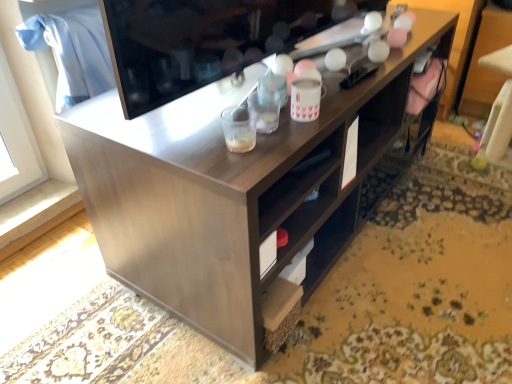
This screenshot has height=384, width=512. What are the coordinates of `matte black television at upper center` in the screenshot? It's located at (203, 41).

Locate an element on the screen. The width and height of the screenshot is (512, 384). translucent plastic cup at center, the second beverage when ordered from back to front is located at coordinates (239, 130).

Which is nearer, (203, 82) or (301, 94)?

Point (203, 82) is farther from the camera than point (301, 94).

Considering the sizes of matte black television at upper center and white ceramic mug at upper center, which is the first beverage in right-to-left order, in the image, is matte black television at upper center taller or shorter than white ceramic mug at upper center, which is the first beverage in right-to-left order,?

Clearly, matte black television at upper center is taller compared to white ceramic mug at upper center, which is the first beverage in right-to-left order.

From a real-world perspective, is matte black television at upper center on top of white ceramic mug at upper center, the second beverage positioned from the front?

Yes, from a real-world perspective, matte black television at upper center is above white ceramic mug at upper center, the second beverage positioned from the front.

Could white ceramic mug at upper center, which is the first beverage in right-to-left order, be considered to be inside matte black television at upper center?

No, white ceramic mug at upper center, which is the first beverage in right-to-left order, is not inside matte black television at upper center.

Is white ceramic mug at upper center, which is the first beverage in right-to-left order, looking in the opposite direction of matte black television at upper center?

Yes, matte black television at upper center is at the back of white ceramic mug at upper center, which is the first beverage in right-to-left order.

Would you say white ceramic mug at upper center, which appears as the second beverage when viewed from the left, is to the left or to the right of matte black television at upper center in the picture?

In the image, white ceramic mug at upper center, which appears as the second beverage when viewed from the left, appears on the right side of matte black television at upper center.

Choose the correct answer: Is white ceramic mug at upper center, the second beverage positioned from the front, inside matte black television at upper center or outside it?

The correct answer is: outside.

From the image's perspective, who appears lower, translucent plastic cup at center, arranged as the 1th beverage when viewed from the left, or white ceramic mug at upper center, arranged as the 1th beverage when viewed from the back?

From the image's view, translucent plastic cup at center, arranged as the 1th beverage when viewed from the left, is below.

In terms of height, does translucent plastic cup at center, which is counted as the 1th beverage, starting from the front, look taller or shorter compared to white ceramic mug at upper center, arranged as the 1th beverage when viewed from the back?

translucent plastic cup at center, which is counted as the 1th beverage, starting from the front, is shorter than white ceramic mug at upper center, arranged as the 1th beverage when viewed from the back.

Which is in front, point (231, 138) or point (295, 107)?

Point (231, 138)

From a real-world perspective, between white ceramic mug at upper center, arranged as the 1th beverage when viewed from the back, and translucent plastic cup at center, the second beverage when ordered from back to front, who is vertically higher?

white ceramic mug at upper center, arranged as the 1th beverage when viewed from the back, is physically above.

How different are the orientations of white ceramic mug at upper center, which appears as the second beverage when viewed from the left, and translucent plastic cup at center, arranged as the 1th beverage when viewed from the left, in degrees?

0.0016 degrees separate the facing orientations of white ceramic mug at upper center, which appears as the second beverage when viewed from the left, and translucent plastic cup at center, arranged as the 1th beverage when viewed from the left.

Where is `beverage below the white ceramic mug at upper center, which is the first beverage in right-to-left order (from the image's perspective)`? beverage below the white ceramic mug at upper center, which is the first beverage in right-to-left order (from the image's perspective) is located at coordinates (239, 130).

From the picture: In terms of height, does white ceramic mug at upper center, the second beverage positioned from the front, look taller or shorter compared to translucent plastic cup at center, the second beverage when ordered from back to front?

In the image, white ceramic mug at upper center, the second beverage positioned from the front, appears to be taller than translucent plastic cup at center, the second beverage when ordered from back to front.

From a real-world perspective, is matte black television at upper center physically below translucent plastic cup at center, the 2th beverage from the right?

Incorrect, from a real-world perspective, matte black television at upper center is higher than translucent plastic cup at center, the 2th beverage from the right.

From the image's perspective, is matte black television at upper center positioned above or below translucent plastic cup at center, arranged as the 1th beverage when viewed from the left?

Based on their image positions, matte black television at upper center is located above translucent plastic cup at center, arranged as the 1th beverage when viewed from the left.

Is matte black television at upper center inside or outside of translucent plastic cup at center, the 2th beverage from the right?

matte black television at upper center is spatially situated outside translucent plastic cup at center, the 2th beverage from the right.

Which is in front, point (268, 47) or point (245, 125)?

The point (245, 125) is closer to the camera.

From the image's perspective, is translucent plastic cup at center, the 2th beverage from the right, located beneath matte black television at upper center?

Yes, from the image's perspective, translucent plastic cup at center, the 2th beverage from the right, is beneath matte black television at upper center.

Which of these two, translucent plastic cup at center, which is counted as the 1th beverage, starting from the front, or matte black television at upper center, stands taller?

Standing taller between the two is matte black television at upper center.

Is translucent plastic cup at center, arranged as the 1th beverage when viewed from the left, touching matte black television at upper center?

No, translucent plastic cup at center, arranged as the 1th beverage when viewed from the left, is not making contact with matte black television at upper center.

There is a matte black television at upper center. Identify the location of the 1st beverage below it (from a real-world perspective). This screenshot has width=512, height=384. point(305,100).

Locate an element on the screen. This screenshot has height=384, width=512. television lying on the left of white ceramic mug at upper center, which appears as the second beverage when viewed from the left is located at coordinates (203, 41).

When comparing their distances from white ceramic mug at upper center, the second beverage positioned from the front, does translucent plastic cup at center, which is counted as the 1th beverage, starting from the front, or matte black television at upper center seem closer?

translucent plastic cup at center, which is counted as the 1th beverage, starting from the front.

From the picture: Estimate the real-world distances between objects in this image. Which object is further from white ceramic mug at upper center, the second beverage positioned from the front, matte black television at upper center or translucent plastic cup at center, the second beverage when ordered from back to front?

The object further to white ceramic mug at upper center, the second beverage positioned from the front, is matte black television at upper center.

Based on their spatial positions, is white ceramic mug at upper center, arranged as the 1th beverage when viewed from the back, or matte black television at upper center further from translucent plastic cup at center, which is counted as the 1th beverage, starting from the front?

matte black television at upper center is further to translucent plastic cup at center, which is counted as the 1th beverage, starting from the front.

Estimate the real-world distances between objects in this image. Which object is closer to translucent plastic cup at center, the second beverage when ordered from back to front, matte black television at upper center or white ceramic mug at upper center, which is the first beverage in right-to-left order?

The object closer to translucent plastic cup at center, the second beverage when ordered from back to front, is white ceramic mug at upper center, which is the first beverage in right-to-left order.

Considering their positions, is white ceramic mug at upper center, the second beverage positioned from the front, positioned further to matte black television at upper center than translucent plastic cup at center, arranged as the 1th beverage when viewed from the left?

The object further to matte black television at upper center is white ceramic mug at upper center, the second beverage positioned from the front.

Looking at the image, which one is located closer to matte black television at upper center, translucent plastic cup at center, arranged as the 1th beverage when viewed from the left, or white ceramic mug at upper center, which appears as the second beverage when viewed from the left?

Among the two, translucent plastic cup at center, arranged as the 1th beverage when viewed from the left, is located nearer to matte black television at upper center.

The width and height of the screenshot is (512, 384). I want to click on beverage between matte black television at upper center and translucent plastic cup at center, which is counted as the 1th beverage, starting from the front, in the vertical direction, so click(x=305, y=100).